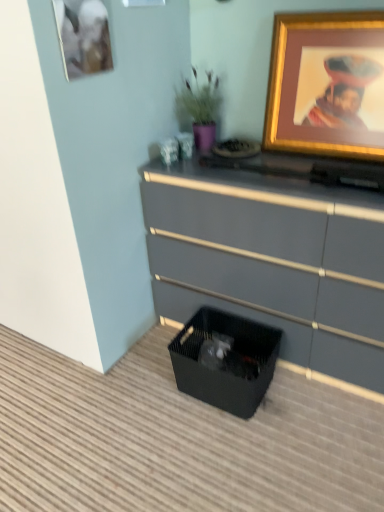
You are a GUI agent. You are given a task and a screenshot of the screen. Output one action in this format:
    pyautogui.click(x=<x>, y=<y>)
    Task: Click on the vacant space that is to the left of black mesh storage box at lower center
    This screenshot has height=512, width=384.
    Given the screenshot: What is the action you would take?
    pyautogui.click(x=145, y=388)